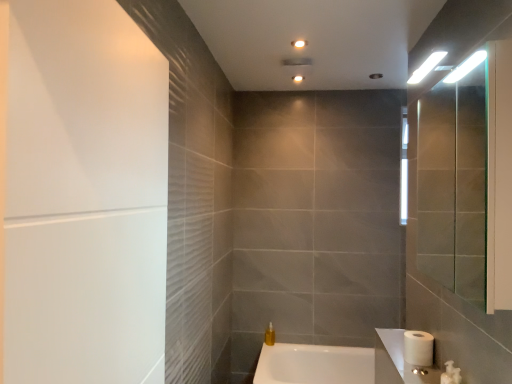
Locate an element on the screen. This screenshot has height=384, width=512. vacant space situated on the left part of matte white ceiling light at upper center is located at coordinates (273, 76).